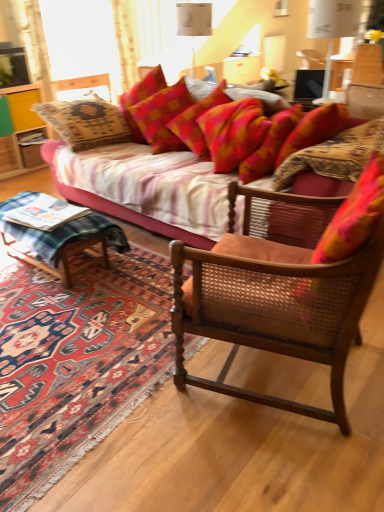
Where is `vacant space in front of green plaid wood at lower left`? Image resolution: width=384 pixels, height=512 pixels. vacant space in front of green plaid wood at lower left is located at coordinates (53, 307).